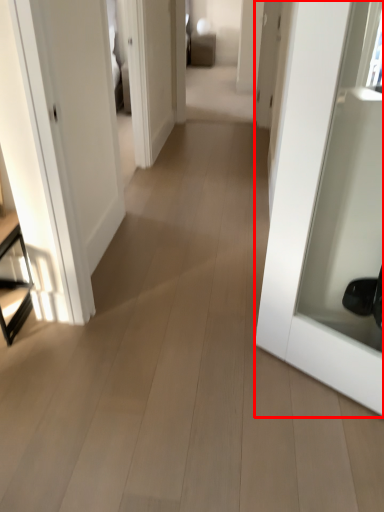
Question: Considering the relative positions of door (annotated by the red box) and furniture in the image provided, where is door (annotated by the red box) located with respect to the staircase?

Choices:
 (A) left
 (B) right

Answer: (B)